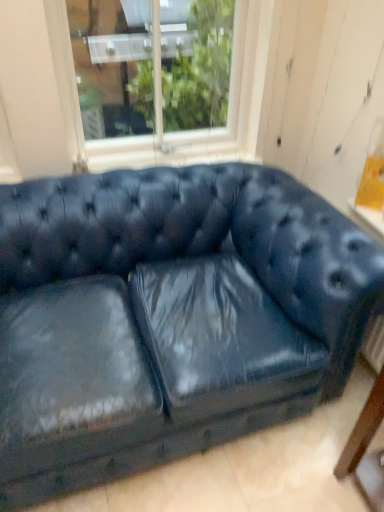
Question: Can we say white wood window at upper center lies outside matte blue leather couch at center?

Choices:
 (A) no
 (B) yes

Answer: (B)

Question: Does white wood window at upper center come behind matte blue leather couch at center?

Choices:
 (A) yes
 (B) no

Answer: (A)

Question: Is white wood window at upper center bigger than matte blue leather couch at center?

Choices:
 (A) yes
 (B) no

Answer: (B)

Question: Considering the relative sizes of white wood window at upper center and matte blue leather couch at center in the image provided, is white wood window at upper center taller than matte blue leather couch at center?

Choices:
 (A) yes
 (B) no

Answer: (B)

Question: Does white wood window at upper center have a lesser height compared to matte blue leather couch at center?

Choices:
 (A) no
 (B) yes

Answer: (B)

Question: Is the depth of white wood window at upper center less than that of matte blue leather couch at center?

Choices:
 (A) no
 (B) yes

Answer: (A)

Question: From a real-world perspective, is matte blue leather couch at center beneath white wood window at upper center?

Choices:
 (A) no
 (B) yes

Answer: (B)

Question: Is matte blue leather couch at center oriented away from white wood window at upper center?

Choices:
 (A) yes
 (B) no

Answer: (B)

Question: Are matte blue leather couch at center and white wood window at upper center located far from each other?

Choices:
 (A) yes
 (B) no

Answer: (B)

Question: Does matte blue leather couch at center have a lesser width compared to white wood window at upper center?

Choices:
 (A) no
 (B) yes

Answer: (A)

Question: Does matte blue leather couch at center appear on the left side of white wood window at upper center?

Choices:
 (A) yes
 (B) no

Answer: (B)

Question: Does matte blue leather couch at center have a greater height compared to white wood window at upper center?

Choices:
 (A) no
 (B) yes

Answer: (B)

Question: From a real-world perspective, is matte blue leather couch at center above or below white wood window at upper center?

Choices:
 (A) below
 (B) above

Answer: (A)